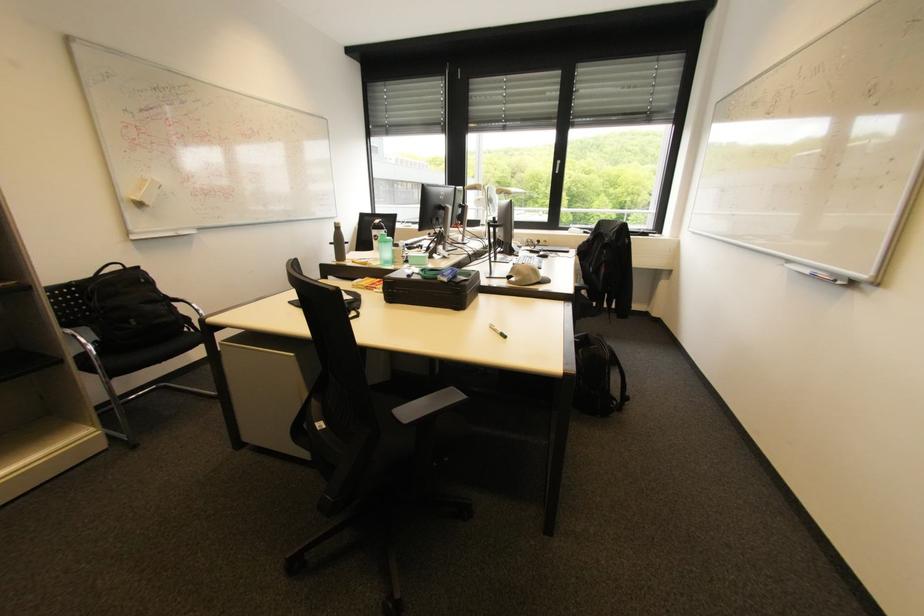
The location [497,331] corresponds to which object?

It refers to a green whiteboard marker.